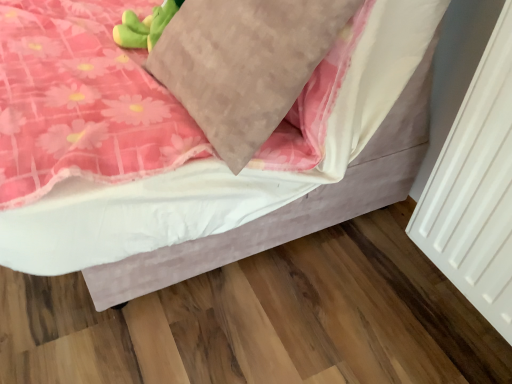
Question: Is velvet pink bed at center not within textured beige pillow at center?

Choices:
 (A) yes
 (B) no

Answer: (A)

Question: Considering the relative sizes of velvet pink bed at center and textured beige pillow at center in the image provided, is velvet pink bed at center thinner than textured beige pillow at center?

Choices:
 (A) yes
 (B) no

Answer: (B)

Question: Is velvet pink bed at center with textured beige pillow at center?

Choices:
 (A) no
 (B) yes

Answer: (A)

Question: Can you confirm if velvet pink bed at center is shorter than textured beige pillow at center?

Choices:
 (A) yes
 (B) no

Answer: (B)

Question: Is velvet pink bed at center closer to camera compared to textured beige pillow at center?

Choices:
 (A) yes
 (B) no

Answer: (A)

Question: Is velvet pink bed at center behind textured beige pillow at center?

Choices:
 (A) no
 (B) yes

Answer: (A)

Question: Is textured beige pillow at center at the right side of velvet pink bed at center?

Choices:
 (A) no
 (B) yes

Answer: (B)

Question: Is textured beige pillow at center outside velvet pink bed at center?

Choices:
 (A) no
 (B) yes

Answer: (A)

Question: Is textured beige pillow at center oriented away from velvet pink bed at center?

Choices:
 (A) no
 (B) yes

Answer: (B)

Question: Is textured beige pillow at center aimed at velvet pink bed at center?

Choices:
 (A) no
 (B) yes

Answer: (B)

Question: From the image's perspective, is textured beige pillow at center below velvet pink bed at center?

Choices:
 (A) yes
 (B) no

Answer: (A)

Question: Is textured beige pillow at center shorter than velvet pink bed at center?

Choices:
 (A) no
 (B) yes

Answer: (B)

Question: From a real-world perspective, is velvet pink bed at center positioned above or below textured beige pillow at center?

Choices:
 (A) below
 (B) above

Answer: (A)